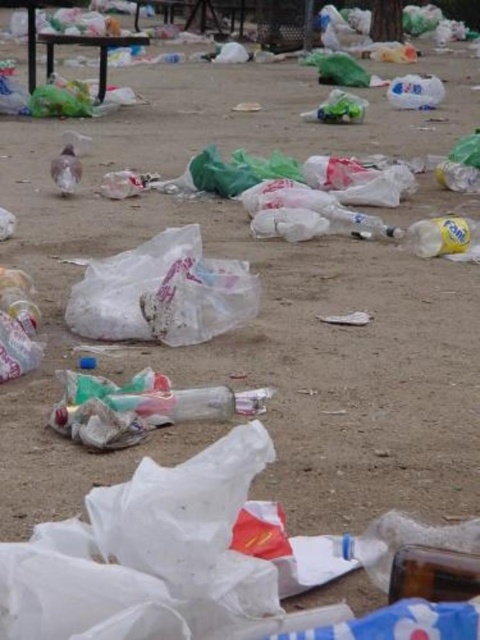
Is point (393, 564) closer to viewer compared to point (433, 256)?

Yes, it is in front of point (433, 256).

Which is more to the left, transparent plastic bottle at lower right or white plastic bottle at center-right?

transparent plastic bottle at lower right

Find the location of a particular element. The width and height of the screenshot is (480, 640). transparent plastic bottle at lower right is located at coordinates (432, 573).

The width and height of the screenshot is (480, 640). In order to click on transparent plastic bottle at lower right in this screenshot , I will do `click(432, 573)`.

Does transparent plastic bag at center appear on the left side of white plastic bottle at center-right?

Indeed, transparent plastic bag at center is positioned on the left side of white plastic bottle at center-right.

Can you confirm if transparent plastic bag at center is positioned above white plastic bottle at center-right?

No.

Who is more forward, [81,320] or [465,250]?

Point [81,320] is in front.

Locate an element on the screen. This screenshot has height=640, width=480. transparent plastic bag at center is located at coordinates (163, 292).

Can you confirm if transparent plastic bag at center is positioned to the left of transparent plastic bottle at lower right?

Yes, transparent plastic bag at center is to the left of transparent plastic bottle at lower right.

Who is positioned more to the right, transparent plastic bag at center or transparent plastic bottle at lower right?

transparent plastic bottle at lower right is more to the right.

What do you see at coordinates (163, 292) in the screenshot? I see `transparent plastic bag at center` at bounding box center [163, 292].

Locate an element on the screen. The height and width of the screenshot is (640, 480). transparent plastic bag at center is located at coordinates (163, 292).